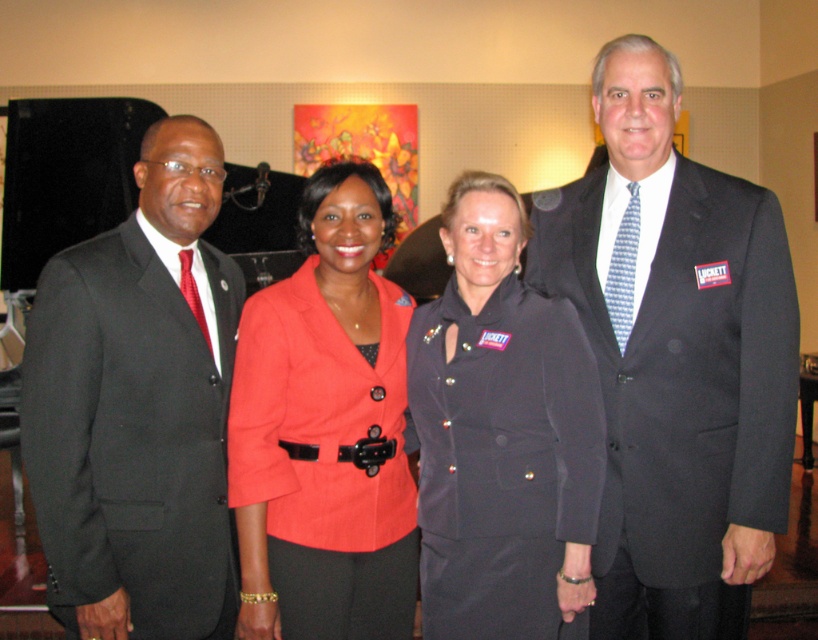
Question: Is matte black suit at left in front of matte red blazer at center?

Choices:
 (A) no
 (B) yes

Answer: (B)

Question: Among these objects, which one is farthest from the camera?

Choices:
 (A) matte black blazer at center
 (B) dark gray suit at center
 (C) matte red blazer at center
 (D) matte black suit at left

Answer: (B)

Question: Which point is farther to the camera?

Choices:
 (A) matte red blazer at center
 (B) matte black suit at left
 (C) matte black blazer at center
 (D) dark gray suit at center

Answer: (D)

Question: Which object is positioned closest to the matte black suit at left?

Choices:
 (A) matte red blazer at center
 (B) dark gray suit at center

Answer: (A)

Question: Observing the image, what is the correct spatial positioning of matte red blazer at center in reference to matte black blazer at center?

Choices:
 (A) above
 (B) below

Answer: (B)

Question: Does dark gray suit at center have a larger size compared to matte black suit at left?

Choices:
 (A) yes
 (B) no

Answer: (A)